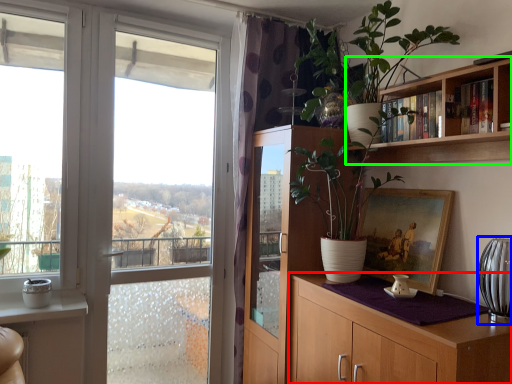
Question: Which is farther away from cabinetry (highlighted by a red box)? glass vase (highlighted by a blue box) or bookcase (highlighted by a green box)?

Choices:
 (A) glass vase
 (B) bookcase

Answer: (B)